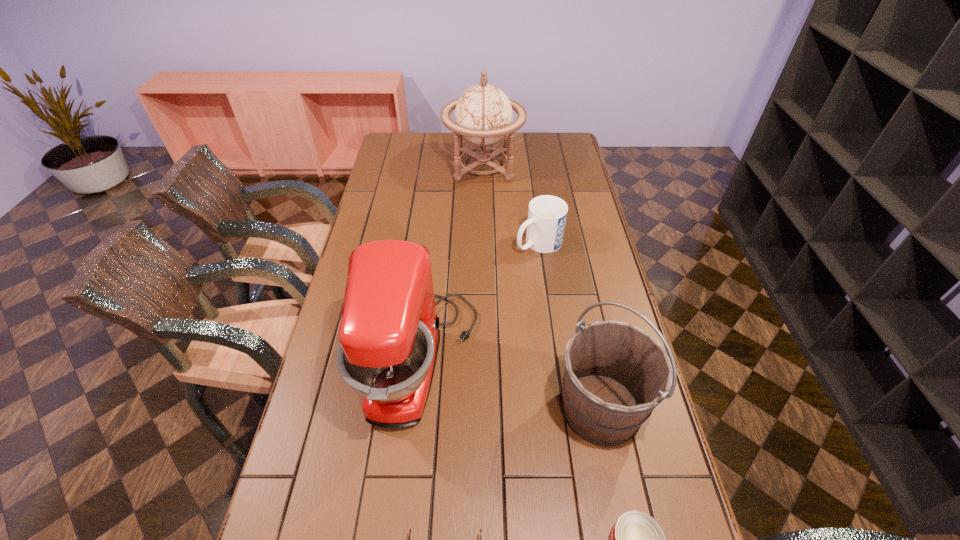
Image resolution: width=960 pixels, height=540 pixels. Identify the location of blank region between the mug and the bucket. (569, 326).

You are a GUI agent. You are given a task and a screenshot of the screen. Output one action in this format:
    pyautogui.click(x=<x>, y=<y>)
    Task: Click on the vacant area that lies between the globe and the bucket
    This screenshot has width=960, height=540.
    Given the screenshot: What is the action you would take?
    pyautogui.click(x=541, y=287)

At what (x,y) coordinates should I click in order to perform the action: click on free spot between the fifth nearest object and the kitchen mixer. Please return your answer as a coordinate pair (x, y). This screenshot has width=960, height=540. Looking at the image, I should click on (479, 302).

Locate an element on the screen. The width and height of the screenshot is (960, 540). free space that is in between the farthest object and the bucket is located at coordinates (541, 287).

I want to click on free space that is in between the mug and the globe, so click(x=511, y=205).

The height and width of the screenshot is (540, 960). Identify the location of the third closest object to the globe. (615, 374).

Locate which object ranks fifth in proximity to the can. Please provide its 2D coordinates. Your answer should be formatted as a tuple, i.e. [(x, y)], where the tuple contains the x and y coordinates of a point satisfying the conditions above.

[(483, 114)]

This screenshot has width=960, height=540. What are the coordinates of `vacant space that satisfies the following two spatial constraints: 1. at the front of the globe showing Africa; 2. on the back side of the mug` in the screenshot? It's located at (484, 243).

The height and width of the screenshot is (540, 960). Find the location of `vacant position in the image that satisfies the following two spatial constraints: 1. at the front of the farthest object showing Africa; 2. on the back side of the bucket`. vacant position in the image that satisfies the following two spatial constraints: 1. at the front of the farthest object showing Africa; 2. on the back side of the bucket is located at coordinates (486, 408).